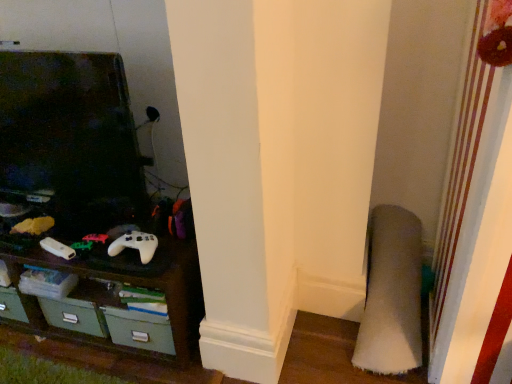
Question: Considering the relative sizes of white matte game controller at lower left, arranged as the 1th game controller when viewed from the left, and dark wood shelf at lower left in the image provided, is white matte game controller at lower left, arranged as the 1th game controller when viewed from the left, thinner than dark wood shelf at lower left?

Choices:
 (A) no
 (B) yes

Answer: (B)

Question: Does white matte game controller at lower left, the second game controller positioned from the right, turn towards dark wood shelf at lower left?

Choices:
 (A) no
 (B) yes

Answer: (A)

Question: From a real-world perspective, is white matte game controller at lower left, arranged as the 1th game controller when viewed from the left, under dark wood shelf at lower left?

Choices:
 (A) yes
 (B) no

Answer: (B)

Question: Is white matte game controller at lower left, arranged as the 1th game controller when viewed from the left, outside of dark wood shelf at lower left?

Choices:
 (A) no
 (B) yes

Answer: (B)

Question: From the image's perspective, is white matte game controller at lower left, the second game controller positioned from the right, below dark wood shelf at lower left?

Choices:
 (A) yes
 (B) no

Answer: (B)

Question: Considering the positions of soft gray carpet at lower right and white matte game controller at center, the second game controller from the left, in the image, is soft gray carpet at lower right taller or shorter than white matte game controller at center, the second game controller from the left,?

Choices:
 (A) short
 (B) tall

Answer: (B)

Question: Is soft gray carpet at lower right inside the boundaries of white matte game controller at center, the second game controller from the left, or outside?

Choices:
 (A) inside
 (B) outside

Answer: (B)

Question: From a real-world perspective, is soft gray carpet at lower right physically located above or below white matte game controller at center, the second game controller from the left?

Choices:
 (A) below
 (B) above

Answer: (A)

Question: Considering the relative positions of soft gray carpet at lower right and white matte game controller at center, the second game controller from the left, in the image provided, is soft gray carpet at lower right to the left or to the right of white matte game controller at center, the second game controller from the left,?

Choices:
 (A) left
 (B) right

Answer: (B)

Question: Considering the positions of white matte game controller at lower left, arranged as the 1th game controller when viewed from the left, and white matte game controller at center, which ranks as the 1th game controller in right-to-left order, in the image, is white matte game controller at lower left, arranged as the 1th game controller when viewed from the left, wider or thinner than white matte game controller at center, which ranks as the 1th game controller in right-to-left order,?

Choices:
 (A) thin
 (B) wide

Answer: (A)

Question: In terms of size, does white matte game controller at lower left, the second game controller positioned from the right, appear bigger or smaller than white matte game controller at center, which ranks as the 1th game controller in right-to-left order?

Choices:
 (A) small
 (B) big

Answer: (A)

Question: From the image's perspective, is white matte game controller at lower left, arranged as the 1th game controller when viewed from the left, above or below white matte game controller at center, the second game controller from the left?

Choices:
 (A) below
 (B) above

Answer: (A)

Question: From a real-world perspective, is white matte game controller at lower left, arranged as the 1th game controller when viewed from the left, physically located above or below white matte game controller at center, which ranks as the 1th game controller in right-to-left order?

Choices:
 (A) below
 (B) above

Answer: (A)

Question: From the image's perspective, relative to soft gray carpet at lower right, is white matte game controller at lower left, the second game controller positioned from the right, above or below?

Choices:
 (A) above
 (B) below

Answer: (A)

Question: Visually, is white matte game controller at lower left, arranged as the 1th game controller when viewed from the left, positioned to the left or to the right of soft gray carpet at lower right?

Choices:
 (A) right
 (B) left

Answer: (B)